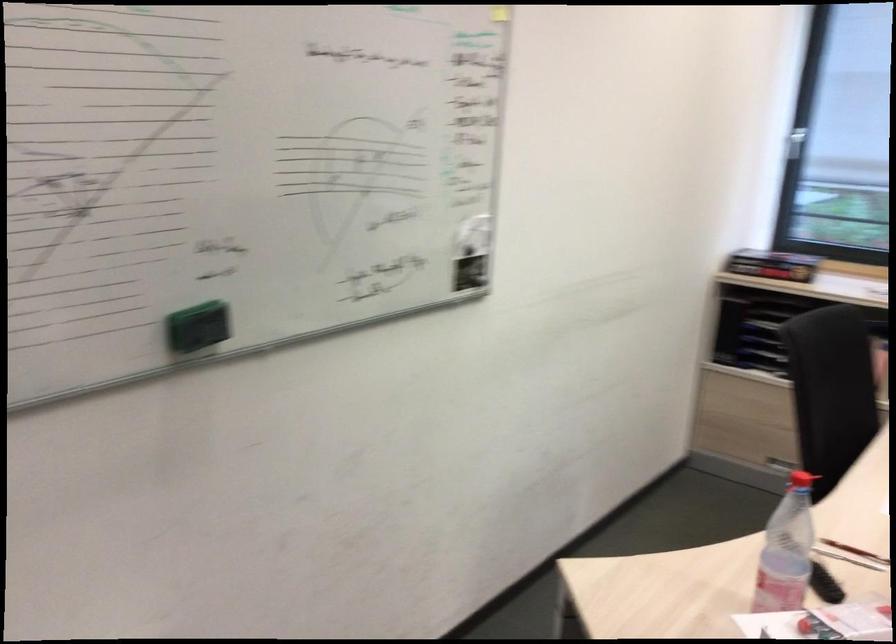
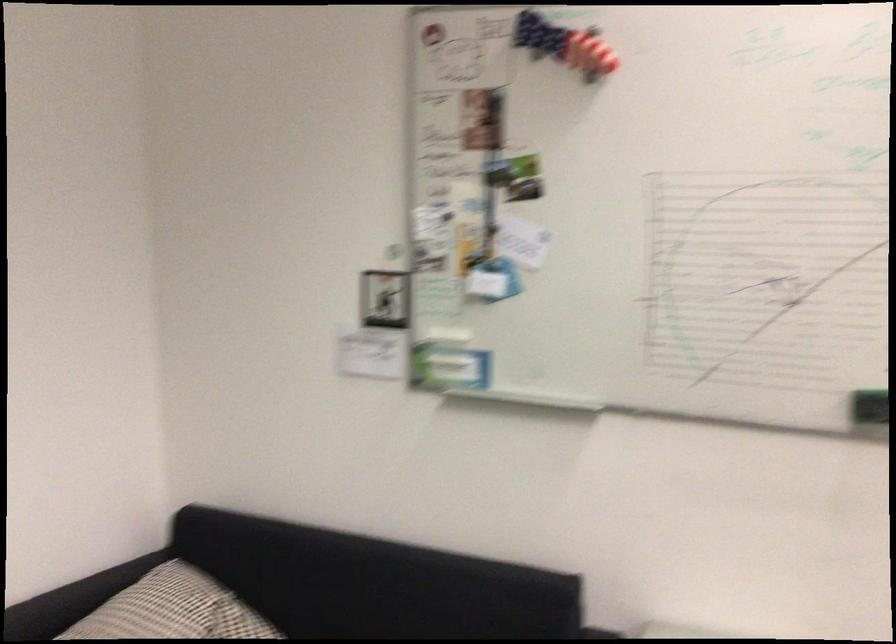
Locate, in the second image, the point that corresponds to (x=197, y=323) in the first image.

(869, 406)